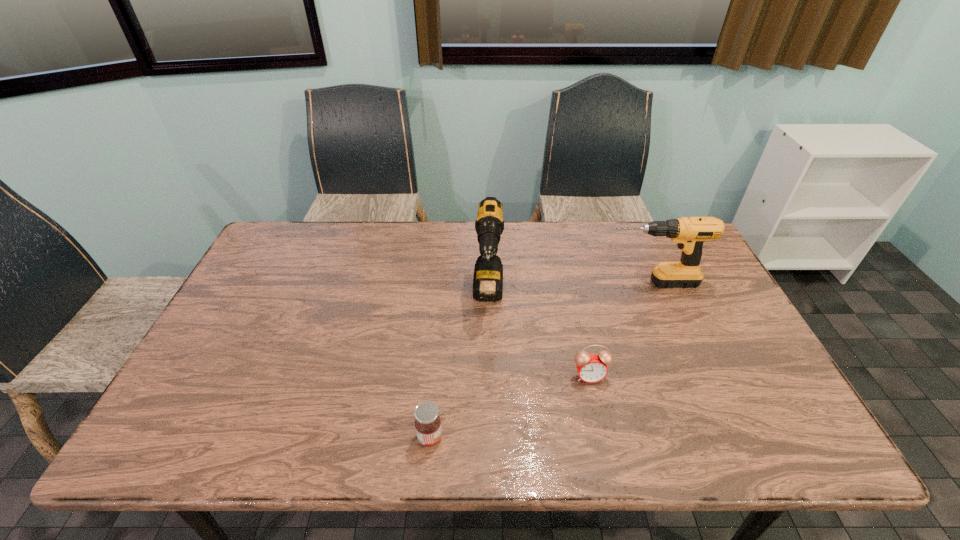
Identify which object is the closest to the right drill. Please provide its 2D coordinates. Your answer should be formatted as a tuple, i.e. [(x, y)], where the tuple contains the x and y coordinates of a point satisfying the conditions above.

[(591, 368)]

Identify the location of object that is the closest to the jam. (x=488, y=273).

You are a GUI agent. You are given a task and a screenshot of the screen. Output one action in this format:
    pyautogui.click(x=<x>, y=<y>)
    Task: Click on the free space that satisfies the following two spatial constraints: 1. at the tip of the rightmost object; 2. at the tip of the third object from right to left
    This screenshot has width=960, height=540.
    Given the screenshot: What is the action you would take?
    pyautogui.click(x=656, y=296)

Image resolution: width=960 pixels, height=540 pixels. Identify the location of free space that satisfies the following two spatial constraints: 1. at the tip of the shorter drill; 2. at the tip of the left drill. (656, 296).

Where is `vacant point that satisfies the following two spatial constraints: 1. at the tip of the shorter drill; 2. on the clock face of the second object from right to left`? vacant point that satisfies the following two spatial constraints: 1. at the tip of the shorter drill; 2. on the clock face of the second object from right to left is located at coordinates (689, 376).

The width and height of the screenshot is (960, 540). I want to click on vacant space that satisfies the following two spatial constraints: 1. at the tip of the right drill; 2. at the tip of the left drill, so click(656, 296).

The height and width of the screenshot is (540, 960). Find the location of `vacant region that satisfies the following two spatial constraints: 1. on the clock face of the third object from left to right; 2. on the label side of the leftmost object`. vacant region that satisfies the following two spatial constraints: 1. on the clock face of the third object from left to right; 2. on the label side of the leftmost object is located at coordinates (603, 437).

The width and height of the screenshot is (960, 540). In order to click on free space that satisfies the following two spatial constraints: 1. at the tip of the third object from right to left; 2. on the label side of the nearest object in this screenshot , I will do point(492,437).

Find the location of a particular element. The height and width of the screenshot is (540, 960). vacant space that satisfies the following two spatial constraints: 1. at the tip of the left drill; 2. on the label side of the nearest object is located at coordinates (492, 437).

Locate an element on the screen. The image size is (960, 540). vacant space that satisfies the following two spatial constraints: 1. at the tip of the left drill; 2. on the label side of the jam is located at coordinates [x=492, y=437].